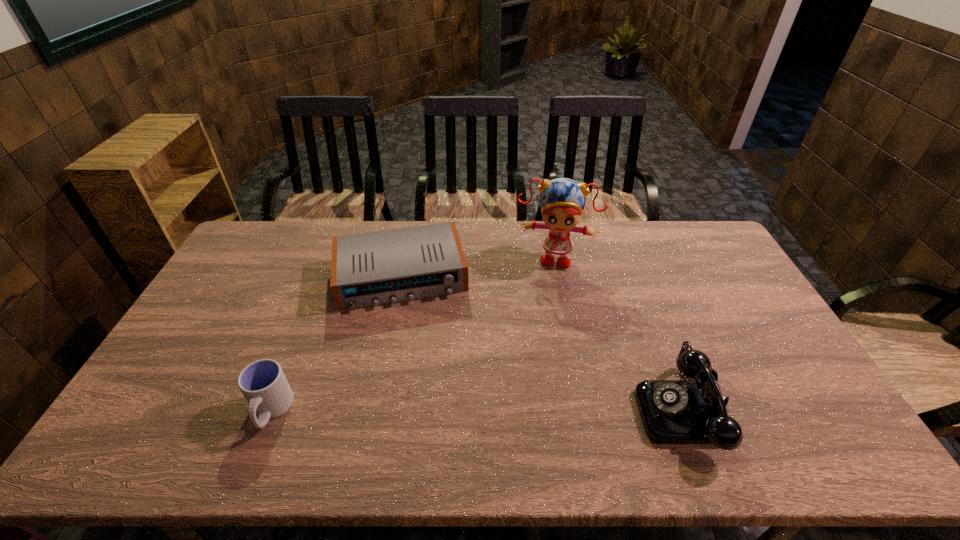
Find the location of a particular element. empty space that is in between the radio receiver and the cup is located at coordinates (336, 343).

I want to click on object that can be found as the third closest to the radio receiver, so click(694, 411).

The width and height of the screenshot is (960, 540). In order to click on the second closest object to the tallest object in this screenshot , I will do `click(694, 411)`.

This screenshot has width=960, height=540. What are the coordinates of `vacant region that satisfies the following two spatial constraints: 1. on the front side of the tallest object; 2. on the dial of the telephone` in the screenshot? It's located at (585, 410).

Locate an element on the screen. The width and height of the screenshot is (960, 540). vacant region that satisfies the following two spatial constraints: 1. on the front side of the telephone; 2. on the dial of the shortest object is located at coordinates (374, 410).

Locate an element on the screen. The image size is (960, 540). vacant point that satisfies the following two spatial constraints: 1. on the front side of the tallest object; 2. on the dial of the telephone is located at coordinates (585, 410).

I want to click on blank space that satisfies the following two spatial constraints: 1. on the front side of the doll; 2. on the dial of the telephone, so click(x=585, y=410).